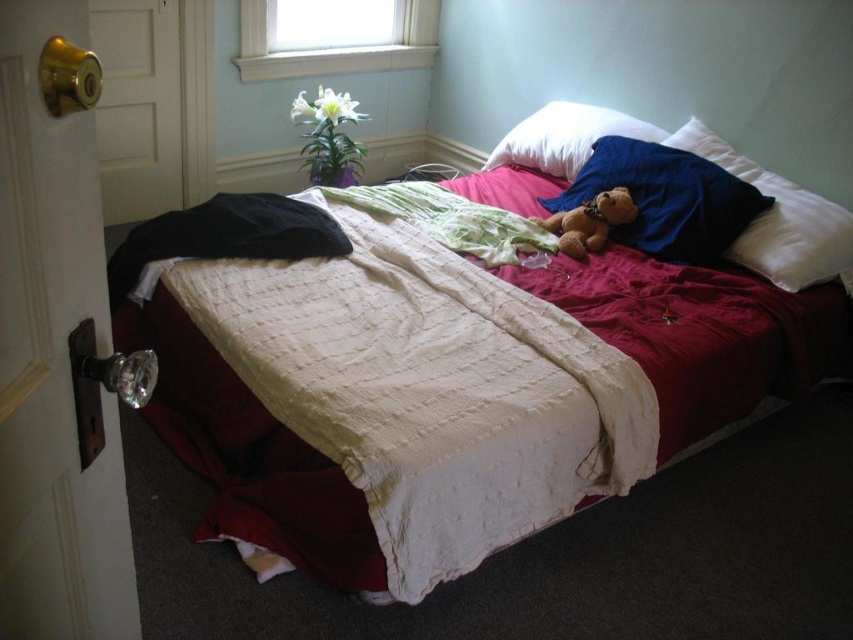
You are organizing the pillows on the bed. The soft blue pillow at upper right and the white soft pillow at upper center are both on the bed. How far apart are these two pillows?

The soft blue pillow at upper right is 12.20 inches away from the white soft pillow at upper center.

You are standing at the foot of the bed and want to place a small vase on the windowsill. You have two points marked on the bedspread at coordinates point (x=689, y=138) and point (x=566, y=168). Which point is closer to the edge of the bedspread where the windowsill is located?

Point (x=689, y=138) is in front of point (x=566, y=168), so it is closer to the edge of the bedspread near the windowsill.